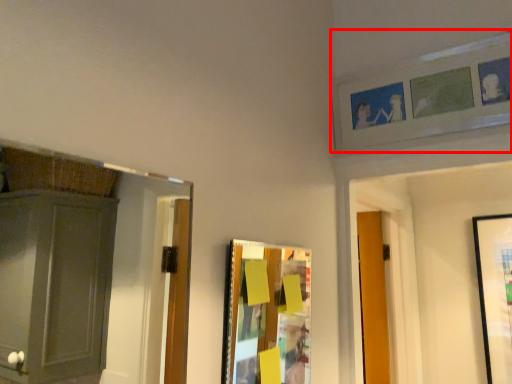
Question: From the image's perspective, where is picture frame (annotated by the red box) located in relation to picture frame in the image?

Choices:
 (A) above
 (B) below

Answer: (A)